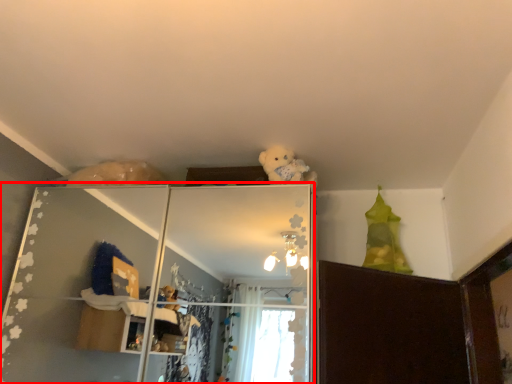
Question: Considering the relative positions of shelf (annotated by the red box) and teddy in the image provided, where is shelf (annotated by the red box) located with respect to the staircase?

Choices:
 (A) right
 (B) left

Answer: (B)